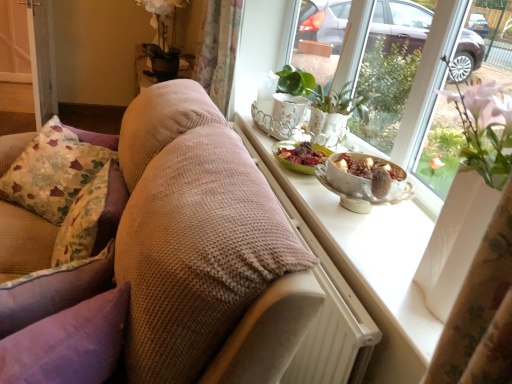
Locate an element on the screen. metallic silver screen door at left is located at coordinates (26, 66).

The image size is (512, 384). I want to click on floral fabric pillow at left, which is counted as the third pillow, starting from the front, so click(x=53, y=171).

Image resolution: width=512 pixels, height=384 pixels. Identify the location of floral fabric cushion at left, placed as the 2th pillow when sorted from front to back. (x=92, y=217).

The width and height of the screenshot is (512, 384). What do you see at coordinates (335, 112) in the screenshot?
I see `green glossy plant at upper center` at bounding box center [335, 112].

The height and width of the screenshot is (384, 512). In order to click on matte white windowsill at upper right in this screenshot , I will do `click(489, 135)`.

Consider the image. In terms of width, does floral fabric pillow at left, which is counted as the third pillow, starting from the front, look wider or thinner when compared to woven fabric couch at center?

In the image, floral fabric pillow at left, which is counted as the third pillow, starting from the front, appears to be more narrow than woven fabric couch at center.

Is woven fabric couch at center inside floral fabric pillow at left, arranged as the first pillow when viewed from the back?

No, woven fabric couch at center is not surrounded by floral fabric pillow at left, arranged as the first pillow when viewed from the back.

Would you say floral fabric curtain at upper center is a long distance from metallic silver screen door at left?

That's right, there is a large distance between floral fabric curtain at upper center and metallic silver screen door at left.

Based on the photo, what's the angular difference between floral fabric curtain at upper center and metallic silver screen door at left's facing directions?

There is a 0.403-degree angle between the facing directions of floral fabric curtain at upper center and metallic silver screen door at left.

From the image's perspective, is floral fabric curtain at upper center over metallic silver screen door at left?

No, from the image's perspective, floral fabric curtain at upper center is not above metallic silver screen door at left.

Is floral fabric curtain at upper center situated inside metallic silver screen door at left or outside?

The correct answer is: outside.

From the image's perspective, is porcelain bowl with fruit at window sill located above or below green glossy plant at upper center?

From the image's perspective, porcelain bowl with fruit at window sill appears below green glossy plant at upper center.

Can you confirm if porcelain bowl with fruit at window sill is bigger than green glossy plant at upper center?

Actually, porcelain bowl with fruit at window sill might be smaller than green glossy plant at upper center.

Considering their positions, is porcelain bowl with fruit at window sill located in front of or behind green glossy plant at upper center?

Visually, porcelain bowl with fruit at window sill is located in front of green glossy plant at upper center.

Between porcelain bowl with fruit at window sill and green glossy plant at upper center, which one has smaller width?

Thinner between the two is green glossy plant at upper center.

Is there a large distance between floral fabric pillow at left, which is counted as the third pillow, starting from the front, and metallic silver screen door at left?

floral fabric pillow at left, which is counted as the third pillow, starting from the front, is far away from metallic silver screen door at left.

Based on their sizes in the image, would you say floral fabric pillow at left, which is counted as the third pillow, starting from the front, is bigger or smaller than metallic silver screen door at left?

Clearly, floral fabric pillow at left, which is counted as the third pillow, starting from the front, is smaller in size than metallic silver screen door at left.

Considering the points (54, 188) and (17, 1), which point is in front, point (54, 188) or point (17, 1)?

The point (54, 188) is in front.

From a real-world perspective, is floral fabric pillow at left, arranged as the first pillow when viewed from the back, located beneath metallic silver screen door at left?

No.

Is point (73, 229) farther from viewer compared to point (325, 187)?

That is False.

Considering the relative positions of floral fabric cushion at left, placed as the 2th pillow when sorted from front to back, and porcelain bowl with fruit at window sill in the image provided, is floral fabric cushion at left, placed as the 2th pillow when sorted from front to back, to the left of porcelain bowl with fruit at window sill from the viewer's perspective?

Indeed, floral fabric cushion at left, placed as the 2th pillow when sorted from front to back, is positioned on the left side of porcelain bowl with fruit at window sill.

Can you see floral fabric cushion at left, which ranks as the second pillow in back-to-front order, touching porcelain bowl with fruit at window sill?

floral fabric cushion at left, which ranks as the second pillow in back-to-front order, is not next to porcelain bowl with fruit at window sill, and they're not touching.

From the image's perspective, relative to porcelain bowl with fruit at window sill, is floral fabric cushion at left, which ranks as the second pillow in back-to-front order, above or below?

floral fabric cushion at left, which ranks as the second pillow in back-to-front order, is below porcelain bowl with fruit at window sill.

Locate an element on the screen. This screenshot has height=384, width=512. the 2nd pillow positioned below the floral fabric curtain at upper center (from the image's perspective) is located at coordinates (92, 217).

Between floral fabric cushion at left, placed as the 2th pillow when sorted from front to back, and floral fabric curtain at upper center, which one is positioned in front?

floral fabric cushion at left, placed as the 2th pillow when sorted from front to back.

Can you see floral fabric cushion at left, which ranks as the second pillow in back-to-front order, touching floral fabric curtain at upper center?

No, floral fabric cushion at left, which ranks as the second pillow in back-to-front order, is not making contact with floral fabric curtain at upper center.

From the image's perspective, is floral fabric cushion at left, which ranks as the second pillow in back-to-front order, over floral fabric curtain at upper center?

No.

How much distance is there between green glossy plant at upper center and matte white windowsill at upper right?

A distance of 14.43 inches exists between green glossy plant at upper center and matte white windowsill at upper right.

Is point (313, 124) closer to camera compared to point (424, 178)?

Yes, point (313, 124) is closer to viewer.

Is green glossy plant at upper center positioned with its back to matte white windowsill at upper right?

Yes, green glossy plant at upper center is positioned with its back facing matte white windowsill at upper right.

Who is smaller, green glossy plant at upper center or matte white windowsill at upper right?

green glossy plant at upper center is smaller.

Locate an element on the screen. The image size is (512, 384). pillow that is the 1st one above the woven fabric couch at center (from a real-world perspective) is located at coordinates (53, 171).

At what (x,y) coordinates should I click in order to perform the action: click on screen door on the left of floral fabric curtain at upper center. Please return your answer as a coordinate pair (x, y). The image size is (512, 384). Looking at the image, I should click on (26, 66).

When comparing their distances from metallic silver screen door at left, does floral fabric cushion at left, placed as the 2th pillow when sorted from front to back, or floral fabric curtain at upper center seem closer?

floral fabric curtain at upper center is closer to metallic silver screen door at left.

Which object lies further to the anchor point purple velvet pillow at left, positioned as the first pillow in front-to-back order, woven fabric couch at center or green glossy plant at upper center?

green glossy plant at upper center lies further to purple velvet pillow at left, positioned as the first pillow in front-to-back order, than the other object.

Looking at the image, which one is located closer to floral fabric pillow at left, which is counted as the third pillow, starting from the front, woven fabric couch at center or matte white windowsill at upper right?

woven fabric couch at center is closer to floral fabric pillow at left, which is counted as the third pillow, starting from the front.

Looking at the image, which one is located closer to purple velvet pillow at left, positioned as the first pillow in front-to-back order, metallic silver screen door at left or floral fabric pillow at left, which is counted as the third pillow, starting from the front?

Based on the image, floral fabric pillow at left, which is counted as the third pillow, starting from the front, appears to be nearer to purple velvet pillow at left, positioned as the first pillow in front-to-back order.

When comparing their distances from floral fabric cushion at left, which ranks as the second pillow in back-to-front order, does purple velvet pillow at left, positioned as the first pillow in front-to-back order, or floral fabric curtain at upper center seem further?

The object further to floral fabric cushion at left, which ranks as the second pillow in back-to-front order, is floral fabric curtain at upper center.

When comparing their distances from woven fabric couch at center, does porcelain bowl with fruit at window sill or metallic silver screen door at left seem further?

metallic silver screen door at left is further to woven fabric couch at center.

Considering their positions, is matte white windowsill at upper right positioned closer to purple velvet pillow at left, which ranks as the 3th pillow in back-to-front order, than porcelain bowl with fruit at window sill?

Based on the image, porcelain bowl with fruit at window sill appears to be nearer to purple velvet pillow at left, which ranks as the 3th pillow in back-to-front order.

When comparing their distances from floral fabric pillow at left, arranged as the first pillow when viewed from the back, does porcelain bowl with fruit at window sill or floral fabric curtain at upper center seem closer?

floral fabric curtain at upper center lies closer to floral fabric pillow at left, arranged as the first pillow when viewed from the back, than the other object.

At what (x,y) coordinates should I click in order to perform the action: click on window sill between floral fabric cushion at left, placed as the 2th pillow when sorted from front to back, and porcelain bowl with fruit at window sill from left to right. Please return your answer as a coordinate pair (x, y). This screenshot has width=512, height=384. Looking at the image, I should click on (369, 264).

In order to click on window positioned between woven fabric couch at center and metallic silver screen door at left from near to far in this screenshot , I will do `click(489, 135)`.

You are a GUI agent. You are given a task and a screenshot of the screen. Output one action in this format:
    pyautogui.click(x=<x>, y=<y>)
    Task: Click on the pillow situated between floral fabric cushion at left, placed as the 2th pillow when sorted from front to back, and matte white windowsill at upper right from left to right
    
    Given the screenshot: What is the action you would take?
    pyautogui.click(x=68, y=343)

The height and width of the screenshot is (384, 512). In order to click on pillow between floral fabric cushion at left, which ranks as the second pillow in back-to-front order, and white glossy window sill at center from left to right in this screenshot , I will do `click(68, 343)`.